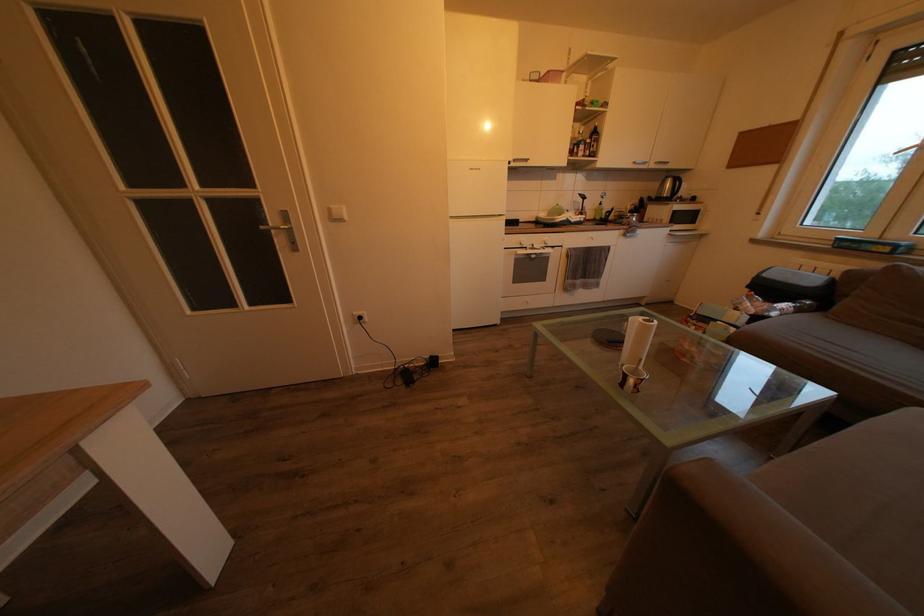
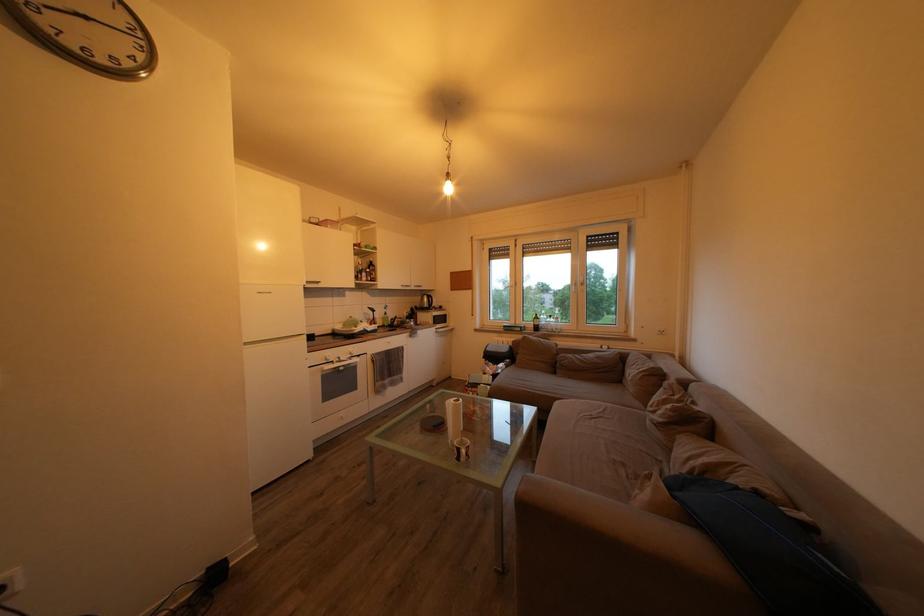
Question: The camera is either moving clockwise (left) or counter-clockwise (right) around the object. The first image is from the beginning of the video and the second image is from the end. Is the camera moving left or right when shooting the video?

Choices:
 (A) Left
 (B) Right

Answer: (A)